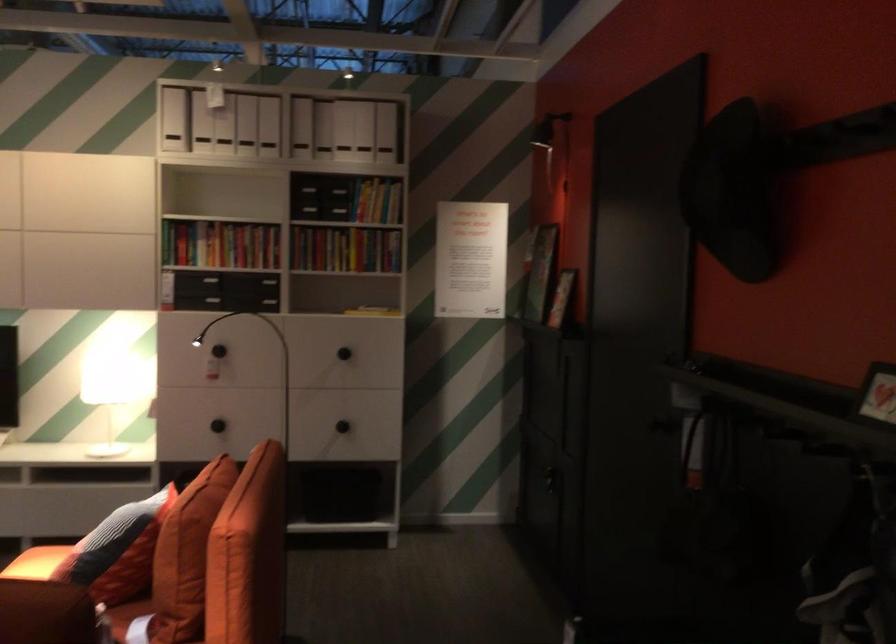
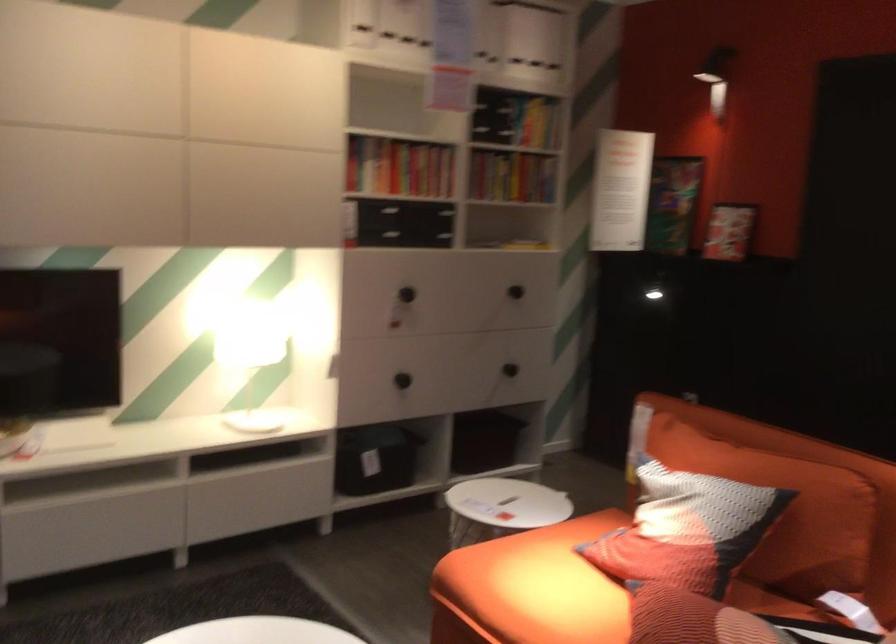
Locate, in the second image, the point that corresponds to pixel 312 361 in the first image.

(514, 292)